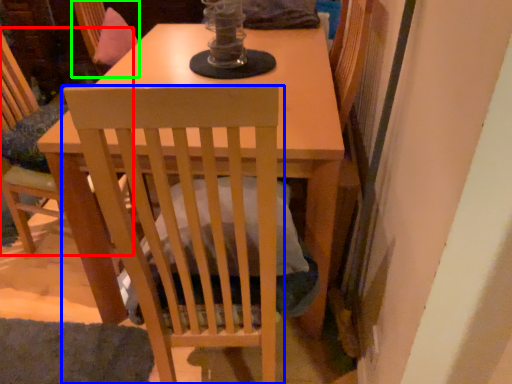
Question: Considering the real-world distances, which object is closest to chair (highlighted by a red box)? chair (highlighted by a blue box) or swivel chair (highlighted by a green box).

Choices:
 (A) chair
 (B) swivel chair

Answer: (B)